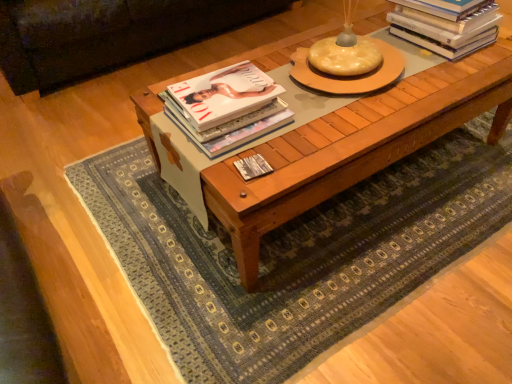
This screenshot has width=512, height=384. Describe the element at coordinates (353, 147) in the screenshot. I see `wooden coffee table at center` at that location.

What is the approximate width of woven rug at center?

woven rug at center is 1.33 meters wide.

In order to face woven rug at center, should I rotate leftwards or rightwards?

Rotate right and turn 8.389 degrees.

Image resolution: width=512 pixels, height=384 pixels. What do you see at coordinates (253, 167) in the screenshot?
I see `white glossy book at center, the third book viewed from the top` at bounding box center [253, 167].

What is the approximate width of dark brown leather couch at upper left?

37.69 inches.

The width and height of the screenshot is (512, 384). What do you see at coordinates (227, 108) in the screenshot? I see `matte hardcover book at center, the second book from the bottom` at bounding box center [227, 108].

Where is `wooden coffee table at center`? The width and height of the screenshot is (512, 384). wooden coffee table at center is located at coordinates (353, 147).

Can you confirm if matte hardcover book at center, the second book from the bottom, is shorter than white glossy book at center, the third book viewed from the top?

No, matte hardcover book at center, the second book from the bottom, is not shorter than white glossy book at center, the third book viewed from the top.

Would you say matte hardcover book at center, which appears as the 1th book when viewed from the left, is a long distance from white glossy book at center, placed as the 2th book when sorted from left to right?

No, matte hardcover book at center, which appears as the 1th book when viewed from the left, is not far from white glossy book at center, placed as the 2th book when sorted from left to right.

Which is more to the right, matte hardcover book at center, which appears as the 1th book when viewed from the left, or white glossy book at center, placed as the 2th book when sorted from left to right?

white glossy book at center, placed as the 2th book when sorted from left to right, is more to the right.

Considering the relative positions of matte hardcover book at center, placed as the second book when sorted from top to bottom, and wooden coffee table at center in the image provided, is matte hardcover book at center, placed as the second book when sorted from top to bottom, in front of wooden coffee table at center?

No, matte hardcover book at center, placed as the second book when sorted from top to bottom, is behind wooden coffee table at center.

Is matte hardcover book at center, which is the 3th book in right-to-left order, positioned with its back to wooden coffee table at center?

No, matte hardcover book at center, which is the 3th book in right-to-left order,'s orientation is not away from wooden coffee table at center.

Does point (279, 113) lie in front of point (181, 78)?

That is True.

In the scene shown: From a real-world perspective, which object rests below the other?

wooden coffee table at center.

Measure the distance from dark brown leather couch at upper left to woven rug at center.

They are 3.98 feet apart.

Considering the points (188, 6) and (473, 231), which point is in front, point (188, 6) or point (473, 231)?

Positioned in front is point (473, 231).

In the image, is dark brown leather couch at upper left on the left side or the right side of woven rug at center?

dark brown leather couch at upper left is positioned on woven rug at center's left side.

From a real-world perspective, which object rests below the other?

In real-world perspective, woven rug at center is lower.

Between matte hardcover book at center, placed as the second book when sorted from top to bottom, and dark brown leather couch at upper left, which one appears on the left side from the viewer's perspective?

dark brown leather couch at upper left.

Locate an element on the screen. couch lying above the matte hardcover book at center, the second book from the bottom (from the image's perspective) is located at coordinates (106, 34).

Is matte hardcover book at center, which is the 3th book in right-to-left order, positioned with its back to dark brown leather couch at upper left?

matte hardcover book at center, which is the 3th book in right-to-left order, does not have its back to dark brown leather couch at upper left.

Who is bigger, matte hardcover book at center, which appears as the 1th book when viewed from the left, or dark brown leather couch at upper left?

Bigger between the two is dark brown leather couch at upper left.

Starting from the wooden coffee table at center, which book is the 1st one behind? Please provide its 2D coordinates.

[(253, 167)]

Which is closer, [265,167] or [396,89]?

Point [265,167] is closer to the camera than point [396,89].

Consider the image. Considering the sizes of white glossy book at center, the third book viewed from the top, and wooden coffee table at center in the image, is white glossy book at center, the third book viewed from the top, wider or thinner than wooden coffee table at center?

white glossy book at center, the third book viewed from the top, is thinner than wooden coffee table at center.

Looking at this image, is white glossy book at center, placed as the 2th book when sorted from left to right, positioned with its back to wooden coffee table at center?

Yes, white glossy book at center, placed as the 2th book when sorted from left to right, is positioned with its back facing wooden coffee table at center.

Could you tell me if hardcover books at upper right, acting as the 3th book starting from the left, is facing white glossy book at center, the 1th book positioned from the bottom?

No, hardcover books at upper right, acting as the 3th book starting from the left, is not oriented towards white glossy book at center, the 1th book positioned from the bottom.

Would you say hardcover books at upper right, positioned as the 1th book in right-to-left order, is inside or outside white glossy book at center, placed as the 2th book when sorted from left to right?

hardcover books at upper right, positioned as the 1th book in right-to-left order, is outside white glossy book at center, placed as the 2th book when sorted from left to right.

From the image's perspective, does hardcover books at upper right, positioned as the 1th book in right-to-left order, appear lower than white glossy book at center, the 1th book positioned from the bottom?

No, from the image's perspective, hardcover books at upper right, positioned as the 1th book in right-to-left order, is not below white glossy book at center, the 1th book positioned from the bottom.

Is point (84, 62) positioned before point (317, 124)?

No, (84, 62) is behind (317, 124).

Could you tell me if dark brown leather couch at upper left is turned towards wooden coffee table at center?

Yes, dark brown leather couch at upper left is facing wooden coffee table at center.

Where is `book in front of the matte hardcover book at center, which appears as the 1th book when viewed from the left`? book in front of the matte hardcover book at center, which appears as the 1th book when viewed from the left is located at coordinates (253, 167).

In order to click on the 2nd book behind the wooden coffee table at center, starting your count from the anchor in this screenshot , I will do `click(227, 108)`.

From the image, which object appears to be nearer to matte hardcover book at center, which is the 3th book in right-to-left order, white glossy book at center, the 1th book positioned from the bottom, or hardcover books at upper right, the 1th book when ordered from top to bottom?

white glossy book at center, the 1th book positioned from the bottom, is closer to matte hardcover book at center, which is the 3th book in right-to-left order.

From the image, which object appears to be nearer to white glossy book at center, the third book viewed from the top, hardcover books at upper right, marked as the third book in a bottom-to-top arrangement, or woven rug at center?

woven rug at center is positioned closer to the anchor white glossy book at center, the third book viewed from the top.

From the image, which object appears to be farther from woven rug at center, wooden coffee table at center or hardcover books at upper right, positioned as the 1th book in right-to-left order?

hardcover books at upper right, positioned as the 1th book in right-to-left order, is positioned further to the anchor woven rug at center.

Considering their positions, is matte hardcover book at center, placed as the second book when sorted from top to bottom, positioned closer to white glossy book at center, the third book viewed from the top, than dark brown leather couch at upper left?

Based on the image, matte hardcover book at center, placed as the second book when sorted from top to bottom, appears to be nearer to white glossy book at center, the third book viewed from the top.

Estimate the real-world distances between objects in this image. Which object is closer to hardcover books at upper right, positioned as the 1th book in right-to-left order, matte hardcover book at center, the second book from the bottom, or woven rug at center?

woven rug at center.

Based on their spatial positions, is woven rug at center or matte hardcover book at center, placed as the second book when sorted from top to bottom, further from white glossy book at center, the 1th book positioned from the bottom?

woven rug at center is further to white glossy book at center, the 1th book positioned from the bottom.

Based on their spatial positions, is matte hardcover book at center, which appears as the 1th book when viewed from the left, or wooden coffee table at center closer to white glossy book at center, the 1th book positioned from the bottom?

Based on the image, matte hardcover book at center, which appears as the 1th book when viewed from the left, appears to be nearer to white glossy book at center, the 1th book positioned from the bottom.

Considering their positions, is hardcover books at upper right, acting as the 3th book starting from the left, positioned further to matte hardcover book at center, which is the 3th book in right-to-left order, than white glossy book at center, the 2th book when ordered from right to left?

hardcover books at upper right, acting as the 3th book starting from the left, lies further to matte hardcover book at center, which is the 3th book in right-to-left order, than the other object.

You are a GUI agent. You are given a task and a screenshot of the screen. Output one action in this format:
    pyautogui.click(x=<x>, y=<y>)
    Task: Click on the table between white glossy book at center, the third book viewed from the top, and hardcover books at upper right, positioned as the 1th book in right-to-left order, in the horizontal direction
    Image resolution: width=512 pixels, height=384 pixels.
    Given the screenshot: What is the action you would take?
    pyautogui.click(x=353, y=147)

Identify the location of table located between dark brown leather couch at upper left and hardcover books at upper right, acting as the 3th book starting from the left, in the left-right direction. This screenshot has height=384, width=512. pos(353,147).

At what (x,y) coordinates should I click in order to perform the action: click on mat between matte hardcover book at center, which appears as the 1th book when viewed from the left, and wooden coffee table at center. Please return your answer as a coordinate pair (x, y). Looking at the image, I should click on (294, 253).

This screenshot has width=512, height=384. I want to click on book located between matte hardcover book at center, the second book from the bottom, and woven rug at center in the left-right direction, so click(253, 167).